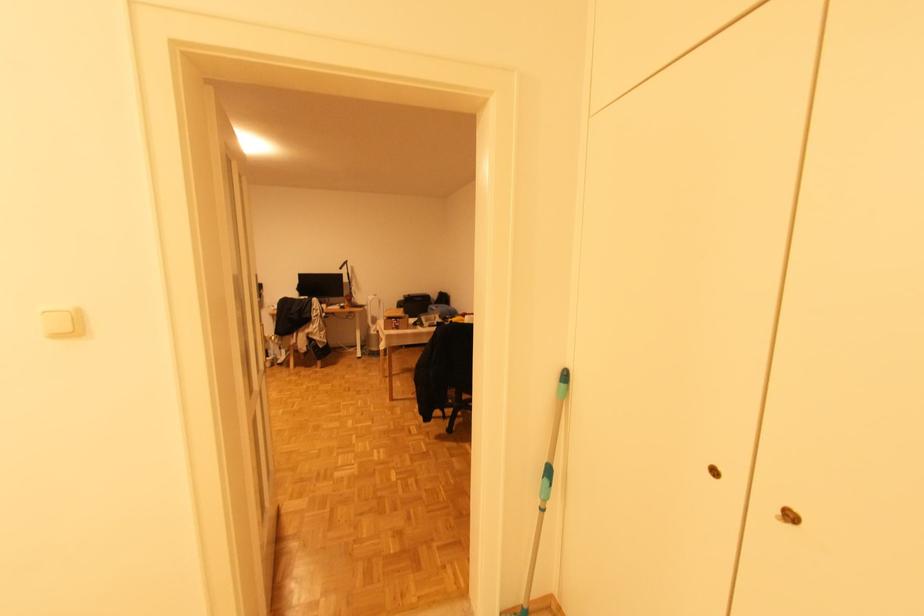
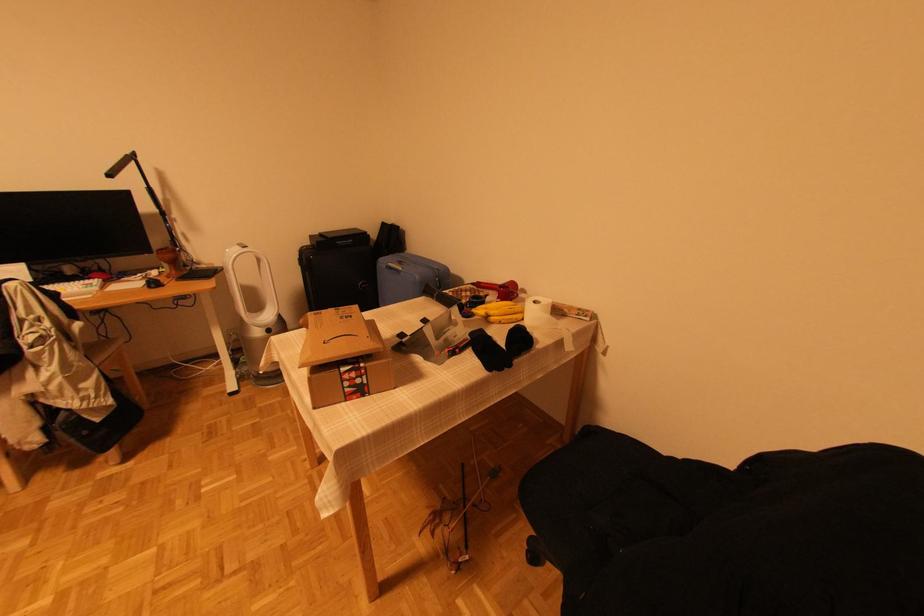
Find the pixel in the second image that matches point (436, 309) in the first image.

(403, 270)